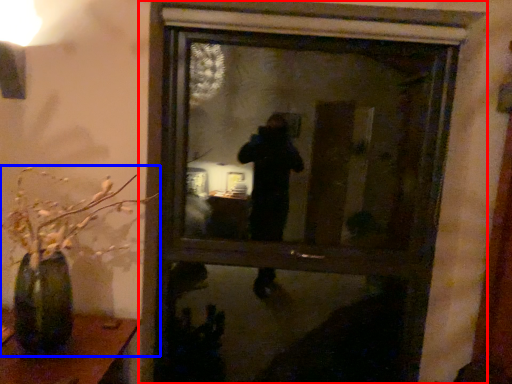
Question: Which object is further to the camera taking this photo, window (highlighted by a red box) or houseplant (highlighted by a blue box)?

Choices:
 (A) window
 (B) houseplant

Answer: (A)